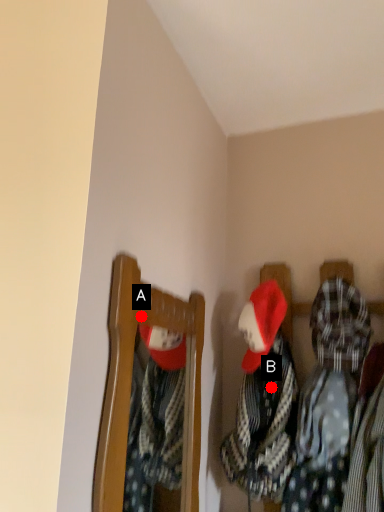
Question: Two points are circled on the image, labeled by A and B beside each circle. Among these points, which one is nearest to the camera?

Choices:
 (A) A is closer
 (B) B is closer

Answer: (A)